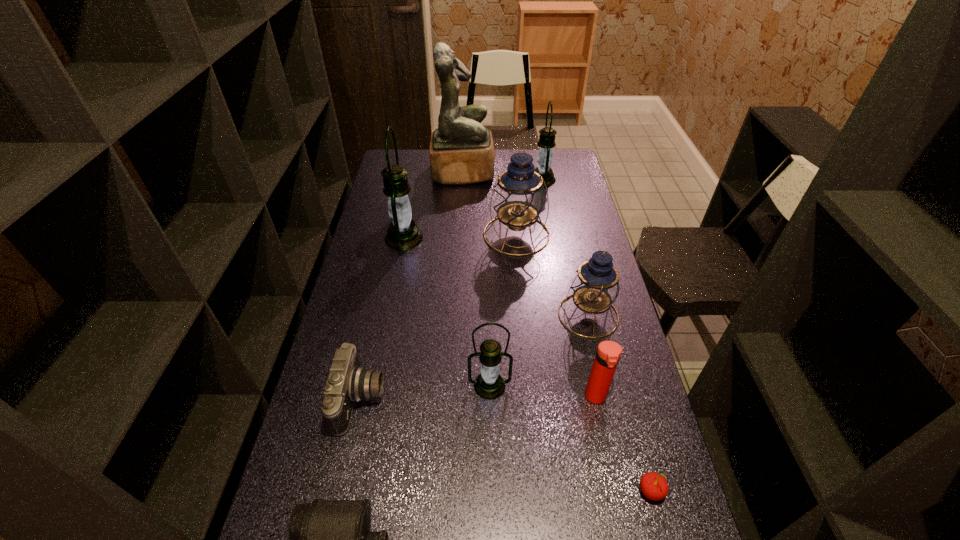
The width and height of the screenshot is (960, 540). Find the location of `unoccupied position between the bigger blue lantern and the second shortest object`. unoccupied position between the bigger blue lantern and the second shortest object is located at coordinates (584, 363).

This screenshot has width=960, height=540. I want to click on free space between the bigger blue lantern and the ninth farthest object, so click(x=584, y=363).

You are a GUI agent. You are given a task and a screenshot of the screen. Output one action in this format:
    pyautogui.click(x=<x>, y=<y>)
    Task: Click on the empty space between the eighth tallest object and the thermos bottle
    
    Given the screenshot: What is the action you would take?
    pyautogui.click(x=478, y=398)

Locate an element on the screen. free space between the ninth shortest object and the black camera is located at coordinates tap(383, 318).

Image resolution: width=960 pixels, height=540 pixels. I want to click on vacant space that is in between the smaller blue lantern and the ninth tallest object, so click(619, 403).

Identify which object is the eighth nearest to the sculpture. Please provide its 2D coordinates. Your answer should be formatted as a tuple, i.e. [(x, y)], where the tuple contains the x and y coordinates of a point satisfying the conditions above.

[(654, 486)]

Choose which object is the seventh nearest neighbor to the red cherry. Please provide its 2D coordinates. Your answer should be formatted as a tuple, i.e. [(x, y)], where the tuple contains the x and y coordinates of a point satisfying the conditions above.

[(403, 234)]

The height and width of the screenshot is (540, 960). What are the coordinates of `the fourth closest lantern to the tallest object` in the screenshot? It's located at (595, 287).

At what (x,y) coordinates should I click in order to perform the action: click on lantern identified as the second closest to the shortest object. Please return your answer as a coordinate pair (x, y). Looking at the image, I should click on (595, 287).

You are a GUI agent. You are given a task and a screenshot of the screen. Output one action in this format:
    pyautogui.click(x=<x>, y=<y>)
    Task: Click on the closest green lantern to the sculpture
    
    Given the screenshot: What is the action you would take?
    pyautogui.click(x=546, y=142)